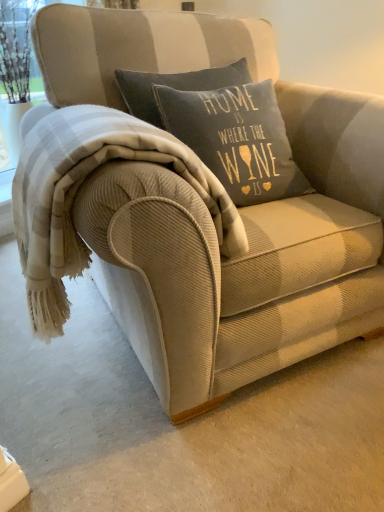
The width and height of the screenshot is (384, 512). What are the coordinates of `beige corduroy blanket at center` in the screenshot? It's located at (79, 187).

This screenshot has width=384, height=512. What do you see at coordinates (79, 187) in the screenshot?
I see `beige corduroy blanket at center` at bounding box center [79, 187].

You are a GUI agent. You are given a task and a screenshot of the screen. Output one action in this format:
    pyautogui.click(x=<x>, y=<y>)
    Task: Click on the beige corduroy blanket at center
    Image resolution: width=384 pixels, height=512 pixels.
    Given the screenshot: What is the action you would take?
    pyautogui.click(x=79, y=187)